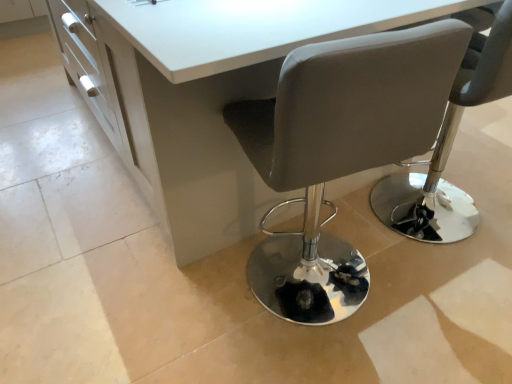
Question: Is white glossy table at center inside the boundaries of matte gray chair at center, the second chair in the left-to-right sequence, or outside?

Choices:
 (A) outside
 (B) inside

Answer: (A)

Question: Visually, is white glossy table at center positioned to the left or to the right of matte gray chair at center, the first chair from the right?

Choices:
 (A) left
 (B) right

Answer: (A)

Question: Considering the real-world distances, which object is closest to the matte gray chair at center, which is the 2th chair in right-to-left order?

Choices:
 (A) white glossy table at center
 (B) matte gray chair at center, the second chair in the left-to-right sequence

Answer: (A)

Question: Which object is the farthest from the matte gray chair at center, marked as the first chair in a left-to-right arrangement?

Choices:
 (A) white glossy table at center
 (B) matte gray chair at center, the second chair in the left-to-right sequence

Answer: (B)